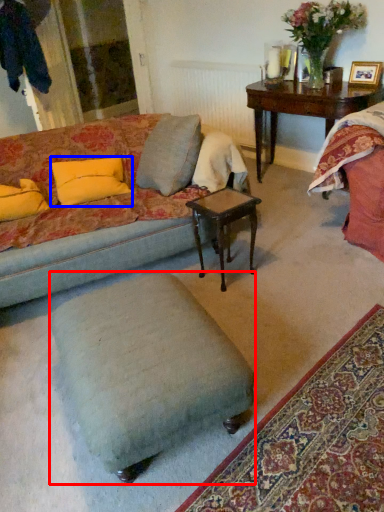
Question: Among these objects, which one is farthest to the camera, stool (highlighted by a red box) or pillow (highlighted by a blue box)?

Choices:
 (A) stool
 (B) pillow

Answer: (B)